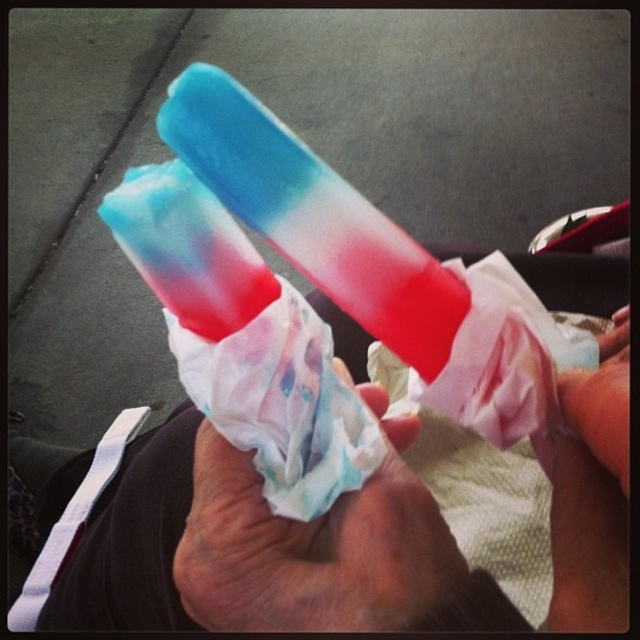
Which is above, translucent paper popsicle at center or matte plastic hand at lower right?

Positioned higher is matte plastic hand at lower right.

Who is shorter, translucent paper popsicle at center or matte plastic hand at lower right?

matte plastic hand at lower right is shorter.

Between point (97, 509) and point (612, 369), which one is positioned in front?

Positioned in front is point (612, 369).

Find the location of a particular element. This screenshot has height=640, width=640. translucent paper popsicle at center is located at coordinates (259, 545).

Does matte paper towel at center appear on the right side of matte plastic hand at lower right?

Incorrect, matte paper towel at center is not on the right side of matte plastic hand at lower right.

Between matte paper towel at center and matte plastic hand at lower right, which one appears on the right side from the viewer's perspective?

matte plastic hand at lower right

Is point (346, 515) positioned behind point (598, 403)?

That is True.

Where is `matte paper towel at center`? matte paper towel at center is located at coordinates (314, 545).

Consider the image. Is translucent paper popsicle at center above matte paper towel at center?

No.

Is point (422, 500) positioned in front of point (259, 570)?

That is False.

Find the location of a particular element. The height and width of the screenshot is (640, 640). translucent paper popsicle at center is located at coordinates (259, 545).